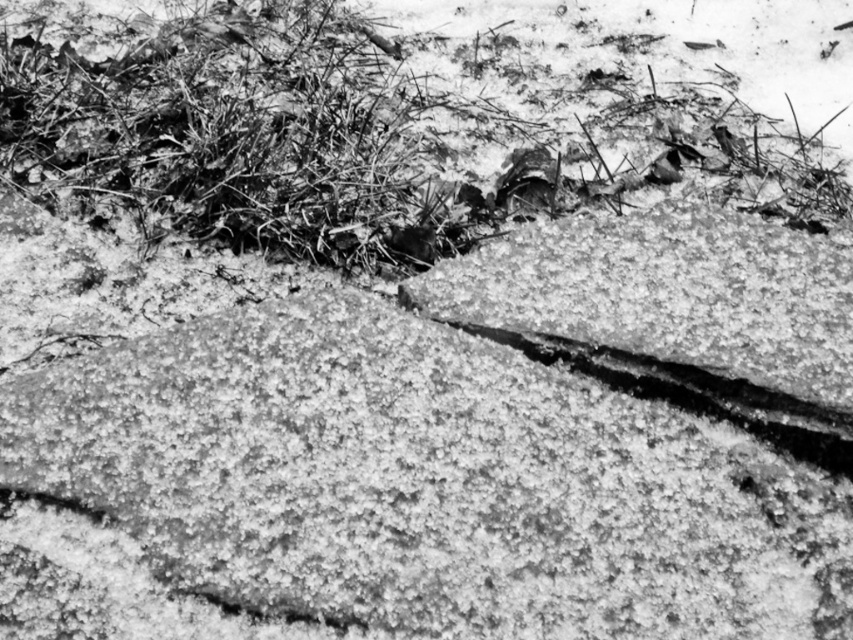
You are an explorer in a snowy landscape. You see a smooth gray rock at center and a coarse textured grass at upper center. Which object is positioned lower in the image?

The smooth gray rock at center is positioned lower than the coarse textured grass at upper center.

You are standing in the snowy landscape shown in the image. You see the smooth gray rock at center and the coarse textured grass at upper center. Which object is nearer to you?

The smooth gray rock at center is closer to the viewer than the coarse textured grass at upper center.